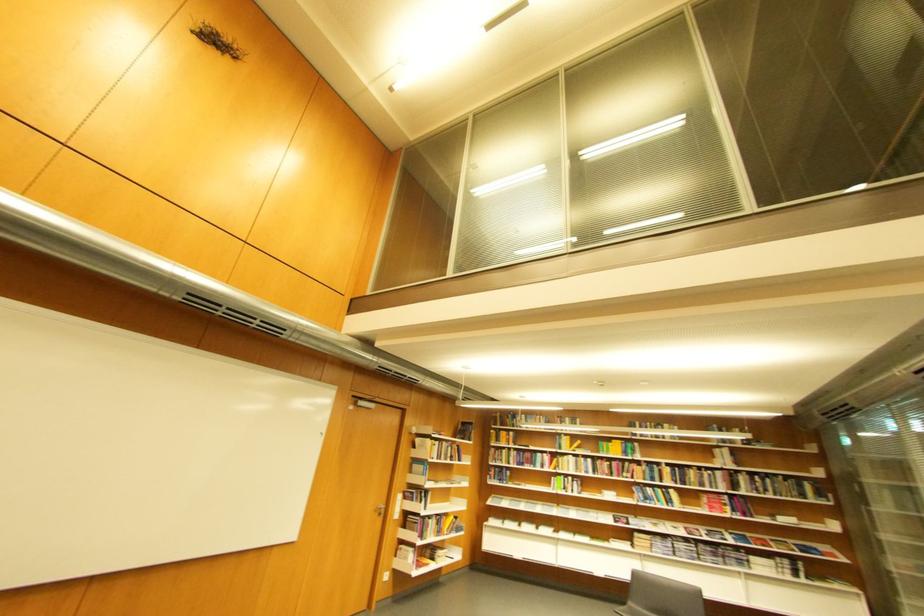
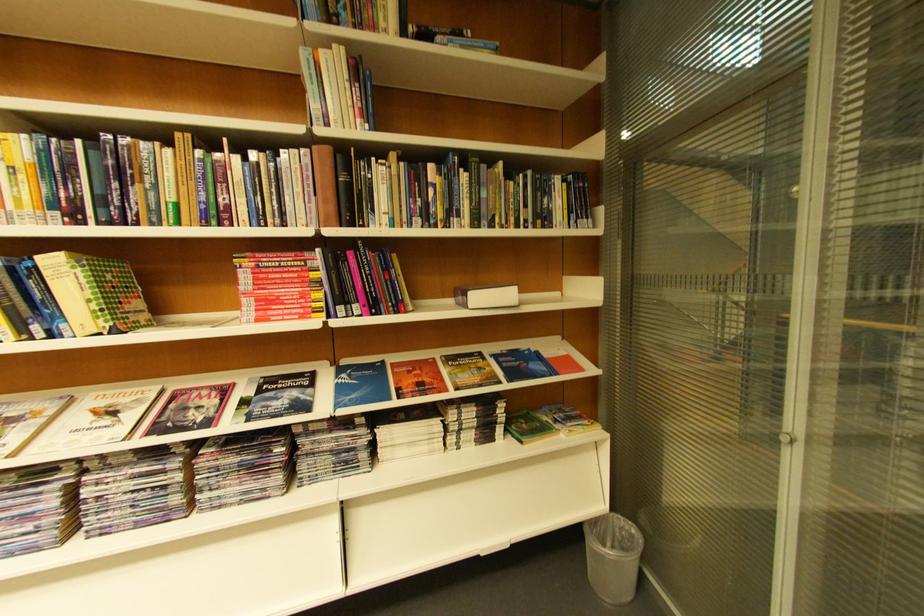
Locate, in the second image, the point that corresponds to point 722,498 in the first image.

(281, 262)